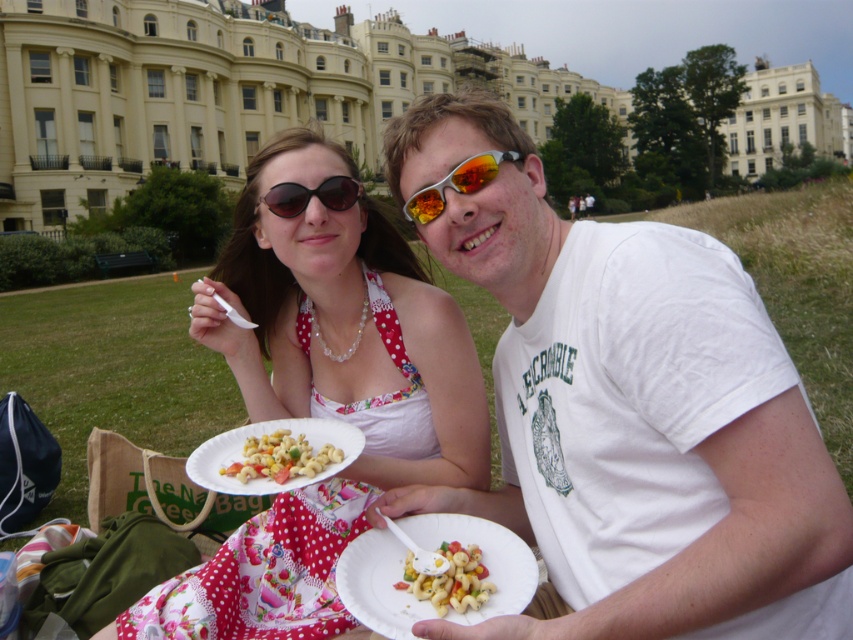
You are standing at the origin point of the image. The coordinates of the matte floral dress at center are given. Can you determine the direction you need to move to reach it?

The coordinates of the matte floral dress at center are at point 0.619 on the x axis and 0.379 on the y axis. Since the origin is at the bottom left corner of the image, you need to move to the right and slightly upwards to reach it.

You are a food delivery person who needs to deliver two different pasta salads to the customers. The customer on the left ordered the multicolored pasta salad at center, and the customer on the right ordered the white glossy pasta salad at center. Based on the scene description, which pasta salad should you place closer to the person on the left?

The multicolored pasta salad at center should be placed closer to the person on the left because it is positioned under the white glossy pasta salad at center, meaning it is lower and likely closer to the left individual.

Looking at this image, you are a photographer trying to capture a closeup shot of the shiny reflective sunglasses at center without the matte floral dress at center blocking the view. Can you adjust your angle so that the sunglasses are fully visible without any part of the dress covering them?

The matte floral dress at center might be wider than shiny reflective sunglasses at center, so there is a possibility that adjusting your angle could allow the sunglasses to be fully visible without the dress blocking them. However, since the dress is wider, it may still partially obscure the sunglasses depending on their exact positions.